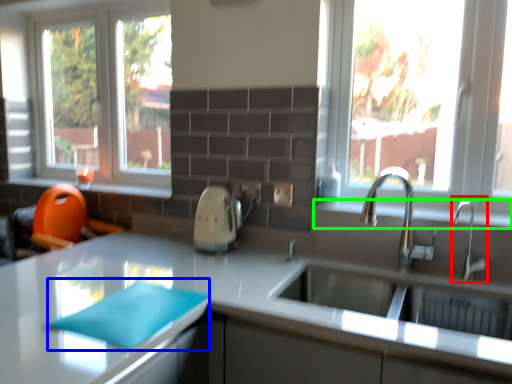
Question: Which object is the closest to the tap (highlighted by a red box)? Choose among these: place mat (highlighted by a blue box) or window sill (highlighted by a green box).

Choices:
 (A) place mat
 (B) window sill

Answer: (B)